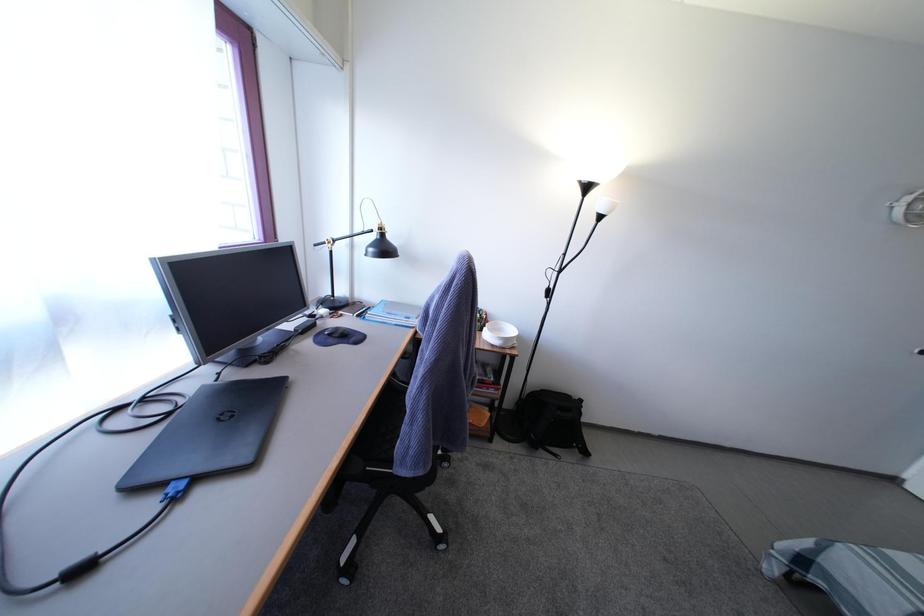
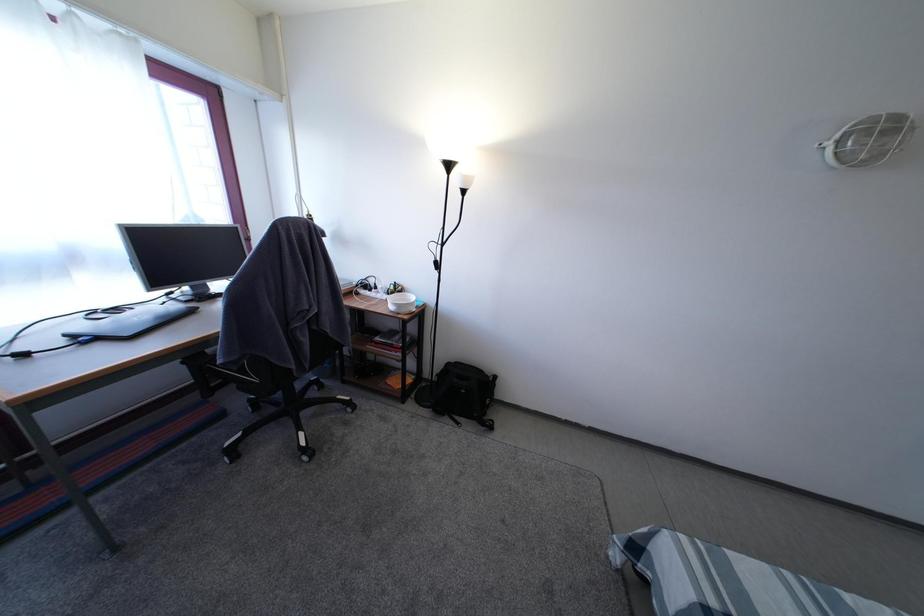
Question: What movement of the cameraman would produce the second image?

Choices:
 (A) Left
 (B) Right
 (C) Forward
 (D) Backward

Answer: (B)